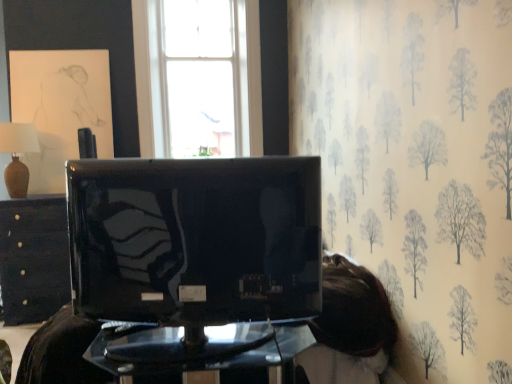
Question: Which direction should I rotate to look at transparent glass table at center, which is the 2th furniture in back-to-front order, — up or down?

Choices:
 (A) up
 (B) down

Answer: (B)

Question: Does black glossy drawer at left, marked as the second furniture in a right-to-left arrangement, have a lesser width compared to matte beige vase at left?

Choices:
 (A) no
 (B) yes

Answer: (A)

Question: Does black glossy drawer at left, marked as the second furniture in a right-to-left arrangement, appear on the left side of matte beige vase at left?

Choices:
 (A) no
 (B) yes

Answer: (A)

Question: From a real-world perspective, is black glossy drawer at left, marked as the second furniture in a right-to-left arrangement, under matte beige vase at left?

Choices:
 (A) no
 (B) yes

Answer: (B)

Question: Does black glossy drawer at left, which is the 1th furniture from left to right, have a greater height compared to matte beige vase at left?

Choices:
 (A) yes
 (B) no

Answer: (A)

Question: Considering the relative sizes of black glossy drawer at left, which is the 1th furniture from left to right, and matte beige vase at left in the image provided, is black glossy drawer at left, which is the 1th furniture from left to right, wider than matte beige vase at left?

Choices:
 (A) yes
 (B) no

Answer: (A)

Question: Is black glossy drawer at left, which is the 1th furniture from left to right, closer to camera compared to matte beige vase at left?

Choices:
 (A) yes
 (B) no

Answer: (B)

Question: From a real-world perspective, is black glossy drawer at left, marked as the second furniture in a right-to-left arrangement, physically above transparent glass table at center, marked as the 2th furniture in a left-to-right arrangement?

Choices:
 (A) yes
 (B) no

Answer: (A)

Question: Can you confirm if black glossy drawer at left, marked as the second furniture in a right-to-left arrangement, is bigger than transparent glass table at center, which is the 2th furniture in back-to-front order?

Choices:
 (A) no
 (B) yes

Answer: (B)

Question: Could transparent glass table at center, which is the 2th furniture in back-to-front order, be considered to be inside black glossy drawer at left, the second furniture viewed from the front?

Choices:
 (A) yes
 (B) no

Answer: (B)

Question: Is black glossy drawer at left, which is the 1th furniture from left to right, facing away from transparent glass table at center, which is the 2th furniture in back-to-front order?

Choices:
 (A) no
 (B) yes

Answer: (A)

Question: From the image's perspective, is black glossy drawer at left, the second furniture viewed from the front, located above transparent glass table at center, which is the 2th furniture in back-to-front order?

Choices:
 (A) yes
 (B) no

Answer: (A)

Question: Can you confirm if black glossy drawer at left, placed as the 1th furniture when sorted from back to front, is smaller than transparent glass table at center, which is the 2th furniture in back-to-front order?

Choices:
 (A) yes
 (B) no

Answer: (B)

Question: Does transparent glass table at center, which is the 2th furniture in back-to-front order, appear on the left side of black glossy drawer at left, which is the 1th furniture from left to right?

Choices:
 (A) yes
 (B) no

Answer: (B)